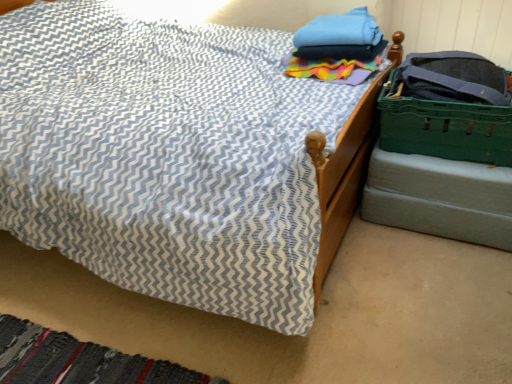
What are the coordinates of `vacant area that is in front of green plastic crate at lower right` in the screenshot? It's located at (438, 277).